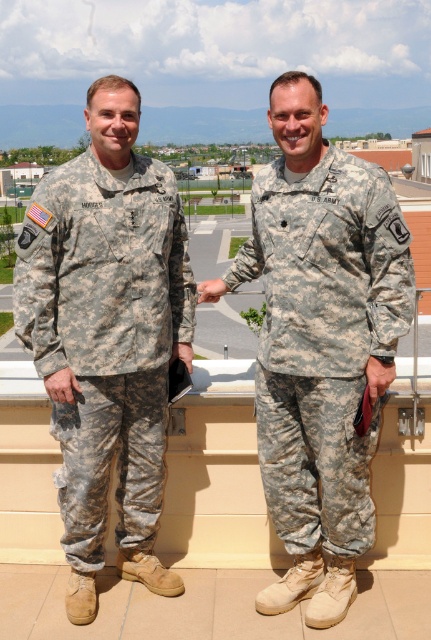
Does camouflage fabric uniform at left come in front of camouflage fabric uniform at center?

No, it is behind camouflage fabric uniform at center.

Which is more to the left, camouflage fabric uniform at left or camouflage fabric uniform at center?

camouflage fabric uniform at left is more to the left.

Between point (65, 192) and point (380, 340), which one is positioned behind?

Positioned behind is point (65, 192).

You are a GUI agent. You are given a task and a screenshot of the screen. Output one action in this format:
    pyautogui.click(x=<x>, y=<y>)
    Task: Click on the camouflage fabric uniform at left
    
    Given the screenshot: What is the action you would take?
    pyautogui.click(x=106, y=337)